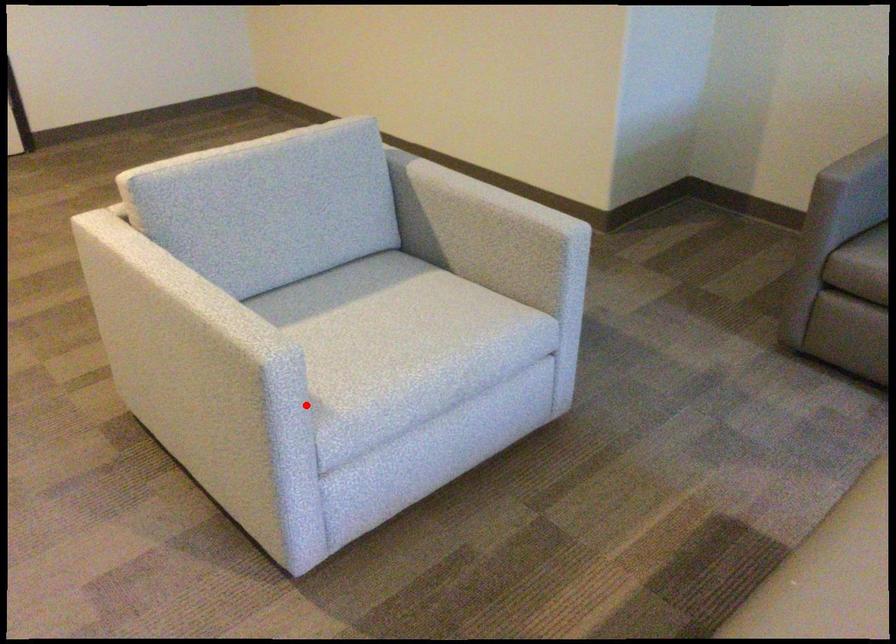
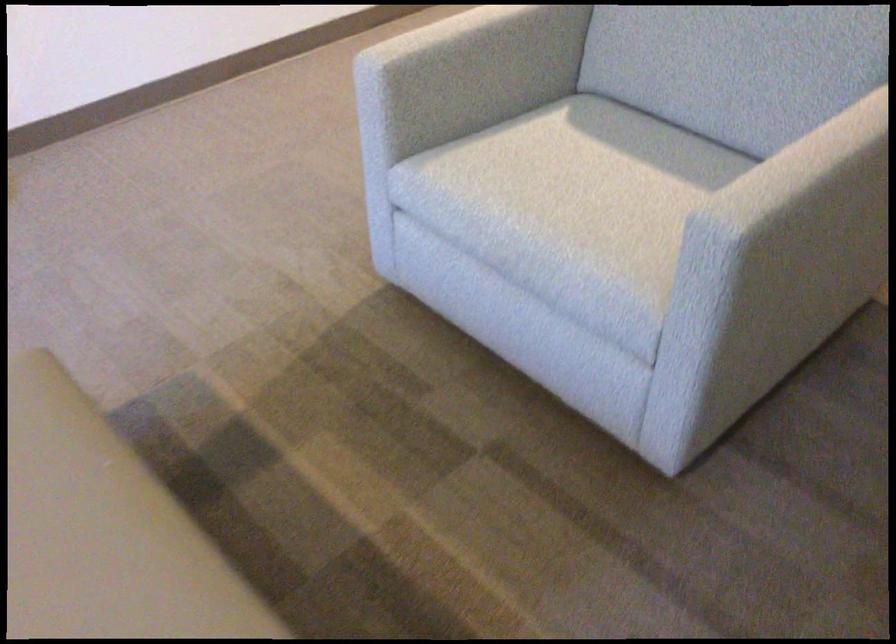
Find the pixel in the second image that matches the highlighted location in the first image.

(385, 120)